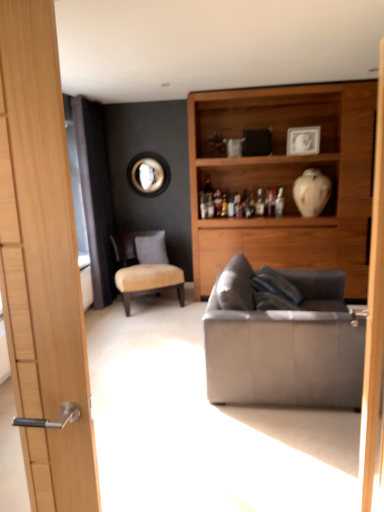
Question: Considering the positions of black fabric screen door at left and white glossy picture frame at upper center in the image, is black fabric screen door at left taller or shorter than white glossy picture frame at upper center?

Choices:
 (A) short
 (B) tall

Answer: (B)

Question: Considering the relative positions of black fabric screen door at left and white glossy picture frame at upper center in the image provided, is black fabric screen door at left to the left or to the right of white glossy picture frame at upper center?

Choices:
 (A) left
 (B) right

Answer: (A)

Question: Based on their relative distances, which object is nearer to the white glossy vase at upper right?

Choices:
 (A) beige fabric chair at center
 (B) black fabric screen door at left
 (C) metallic circular mirror at upper center
 (D) wooden cabinet at upper right
 (E) white fabric pillow at center

Answer: (D)

Question: Based on their relative distances, which object is nearer to the suede gray couch at right?

Choices:
 (A) wooden cabinet at upper right
 (B) black fabric screen door at left
 (C) white glossy picture frame at upper center
 (D) white fabric pillow at center
 (E) beige fabric chair at center

Answer: (E)